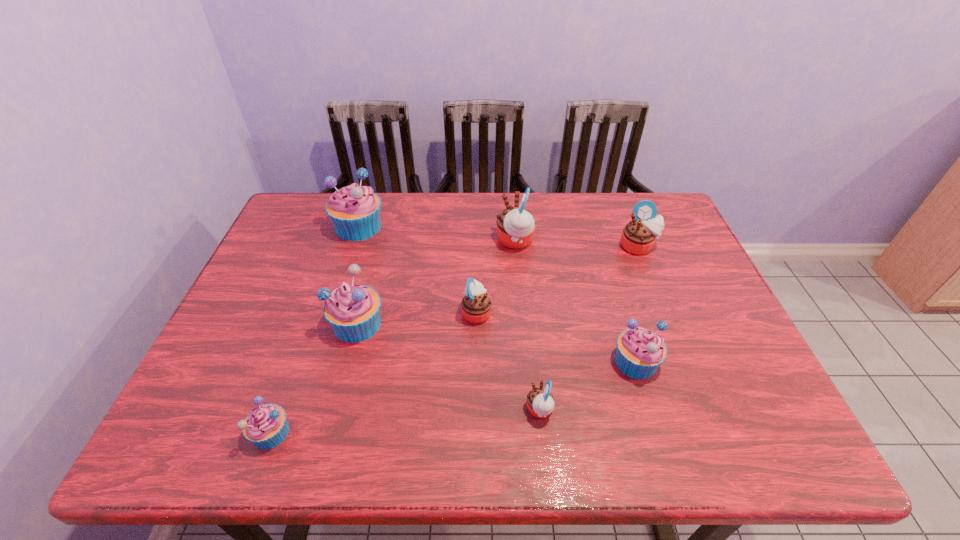
I want to click on the biggest pink muffin, so click(516, 226).

Locate an element on the screen. The image size is (960, 540). the biggest blue muffin is located at coordinates (355, 211).

This screenshot has width=960, height=540. Find the location of `the third smallest blue muffin`. the third smallest blue muffin is located at coordinates (353, 310).

Where is `the rightmost object`? This screenshot has width=960, height=540. the rightmost object is located at coordinates (638, 237).

Where is `the third smallest pink muffin`? The height and width of the screenshot is (540, 960). the third smallest pink muffin is located at coordinates (638, 237).

At what (x,y) coordinates should I click in order to perform the action: click on the second nearest pink muffin. Please return your answer as a coordinate pair (x, y). The image size is (960, 540). Looking at the image, I should click on (476, 305).

I want to click on the fifth object from right to left, so click(476, 305).

Where is `the second muffin from right to left`? the second muffin from right to left is located at coordinates (640, 352).

The width and height of the screenshot is (960, 540). Identify the location of the third biggest blue muffin. (640, 352).

Where is `the nearest blue muffin`? Image resolution: width=960 pixels, height=540 pixels. the nearest blue muffin is located at coordinates (266, 427).